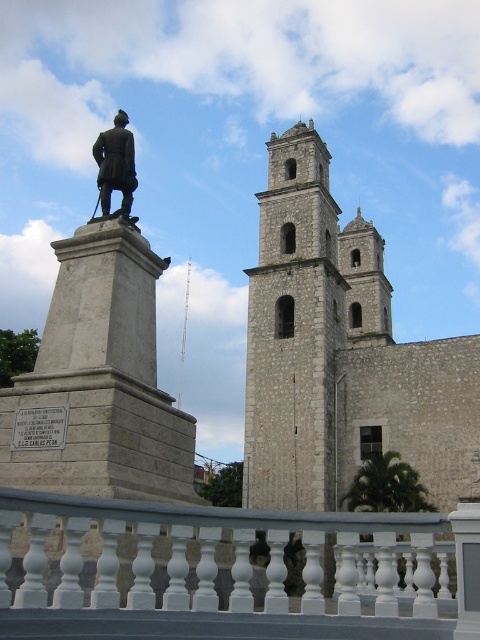
You are standing at the point marked by the coordinates point (232, 572) in the image. Looking around, which object from the scene is directly in front of you?

The white painted wood railing at lower center is directly in front of you at the coordinates point (232, 572).

You are standing at the edge of a historical plaza and notice the white painted wood railing at lower center and the white stone church at center. Which object takes up more space in the image?

The white stone church at center occupies more space than the white painted wood railing at lower center.